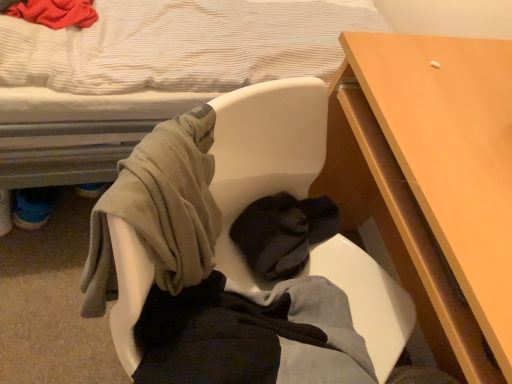
Question: Is wooden desk at center right bigger than white fabric bed at upper left?

Choices:
 (A) yes
 (B) no

Answer: (B)

Question: From the image's perspective, does wooden desk at center right appear higher than white fabric bed at upper left?

Choices:
 (A) no
 (B) yes

Answer: (A)

Question: Considering the relative sizes of wooden desk at center right and white fabric bed at upper left in the image provided, is wooden desk at center right taller than white fabric bed at upper left?

Choices:
 (A) no
 (B) yes

Answer: (A)

Question: Is wooden desk at center right surrounding white fabric bed at upper left?

Choices:
 (A) no
 (B) yes

Answer: (A)

Question: Is wooden desk at center right thinner than white fabric bed at upper left?

Choices:
 (A) no
 (B) yes

Answer: (B)

Question: Is wooden desk at center right facing away from white fabric bed at upper left?

Choices:
 (A) yes
 (B) no

Answer: (B)

Question: Is white fabric bed at upper left at the right side of wooden desk at center right?

Choices:
 (A) no
 (B) yes

Answer: (A)

Question: Is white fabric bed at upper left to the left of wooden desk at center right from the viewer's perspective?

Choices:
 (A) yes
 (B) no

Answer: (A)

Question: Can you confirm if white fabric bed at upper left is shorter than wooden desk at center right?

Choices:
 (A) yes
 (B) no

Answer: (B)

Question: Does white fabric bed at upper left have a lesser width compared to wooden desk at center right?

Choices:
 (A) no
 (B) yes

Answer: (A)

Question: Considering the relative sizes of white fabric bed at upper left and wooden desk at center right in the image provided, is white fabric bed at upper left taller than wooden desk at center right?

Choices:
 (A) no
 (B) yes

Answer: (B)

Question: From a real-world perspective, is white fabric bed at upper left physically below wooden desk at center right?

Choices:
 (A) yes
 (B) no

Answer: (B)

Question: Is wooden desk at center right taller than soft fabric chair at center?

Choices:
 (A) no
 (B) yes

Answer: (B)